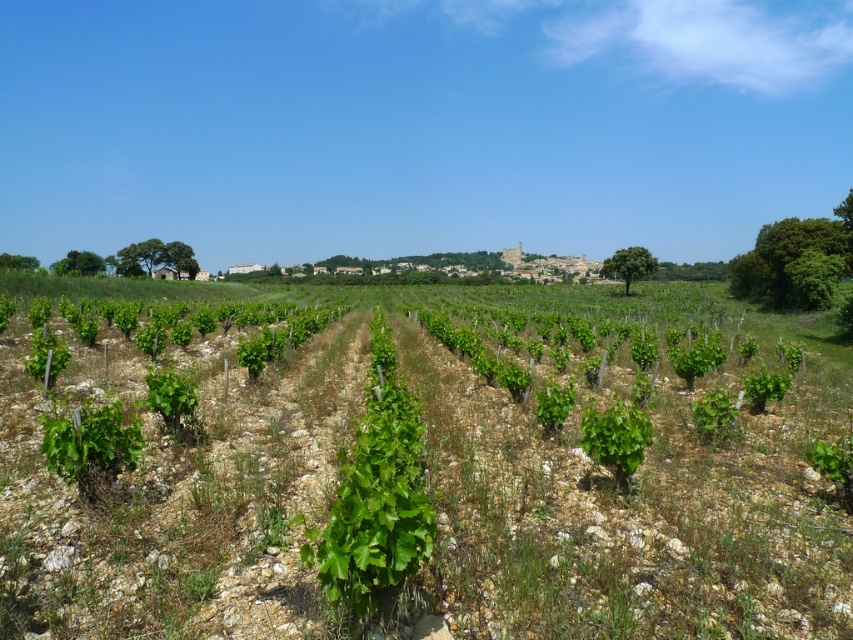
Question: Which point is farther to the camera?

Choices:
 (A) (173, 412)
 (B) (624, 419)

Answer: (A)

Question: Is green leafy plant at center smaller than green leafy plant at lower left?

Choices:
 (A) yes
 (B) no

Answer: (A)

Question: Which object appears closest to the camera in this image?

Choices:
 (A) green leafy plant at center
 (B) green leafy plant at lower left

Answer: (A)

Question: Does green leafy plant at center come in front of green leafy plant at lower left?

Choices:
 (A) no
 (B) yes

Answer: (B)

Question: Which point is closer to the camera?

Choices:
 (A) (160, 378)
 (B) (610, 419)

Answer: (B)

Question: Does green leafy plant at center appear on the left side of green leafy plant at lower left?

Choices:
 (A) no
 (B) yes

Answer: (A)